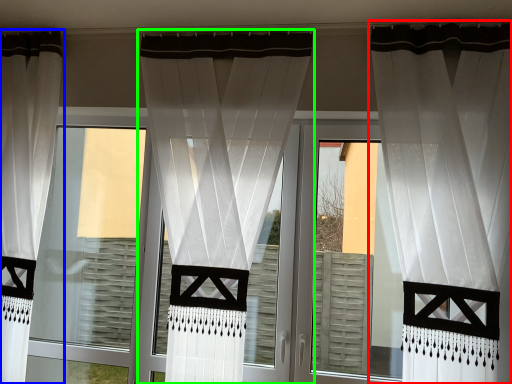
Question: Which object is the closest to the curtain (highlighted by a red box)? Choose among these: curtain (highlighted by a blue box) or curtain (highlighted by a green box).

Choices:
 (A) curtain
 (B) curtain

Answer: (B)